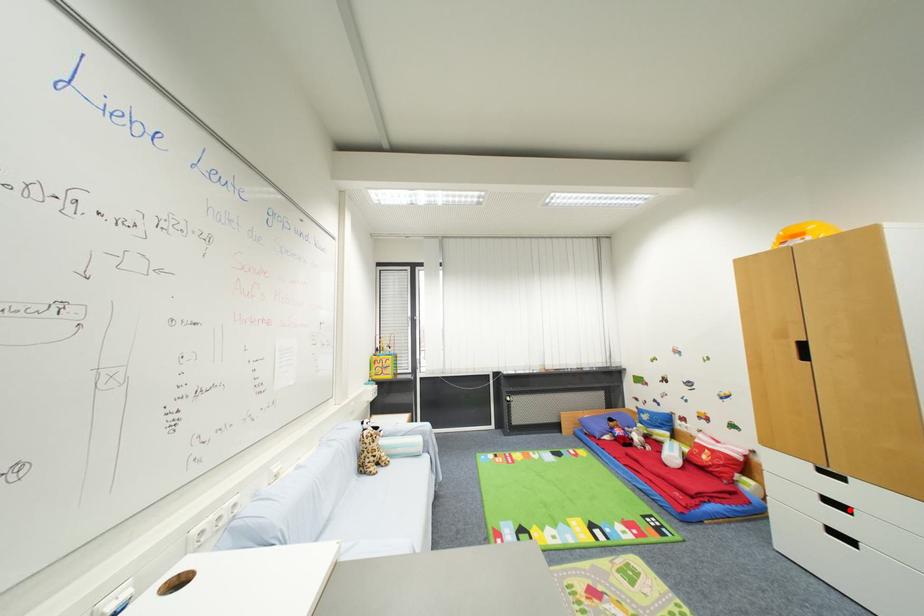
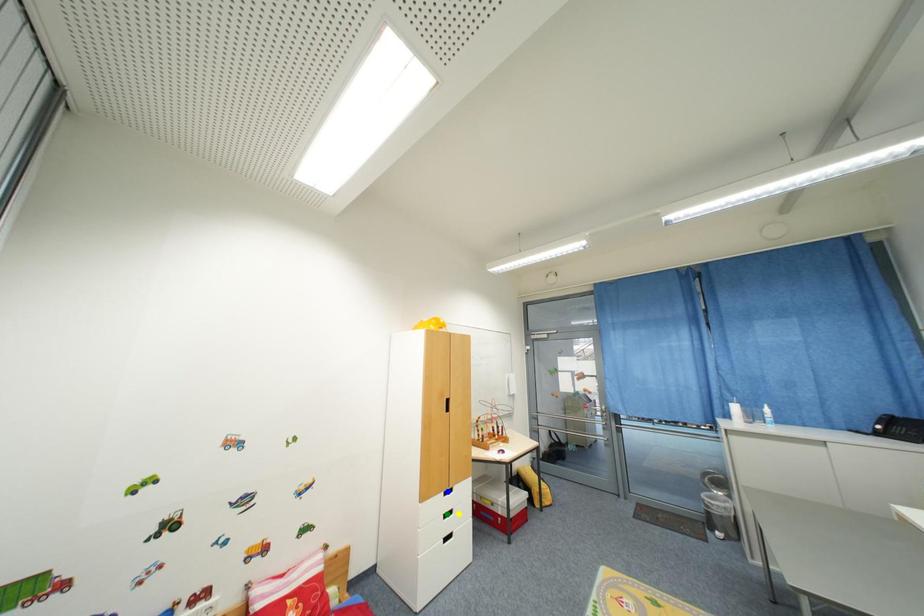
Question: I am providing you with two images of the same scene from different viewpoints. A red point is marked on the first image. You are given multiple points on the second image. Which spot in image 2 lines up with the point in image 1?

Choices:
 (A) blue point
 (B) yellow point
 (C) green point

Answer: (B)